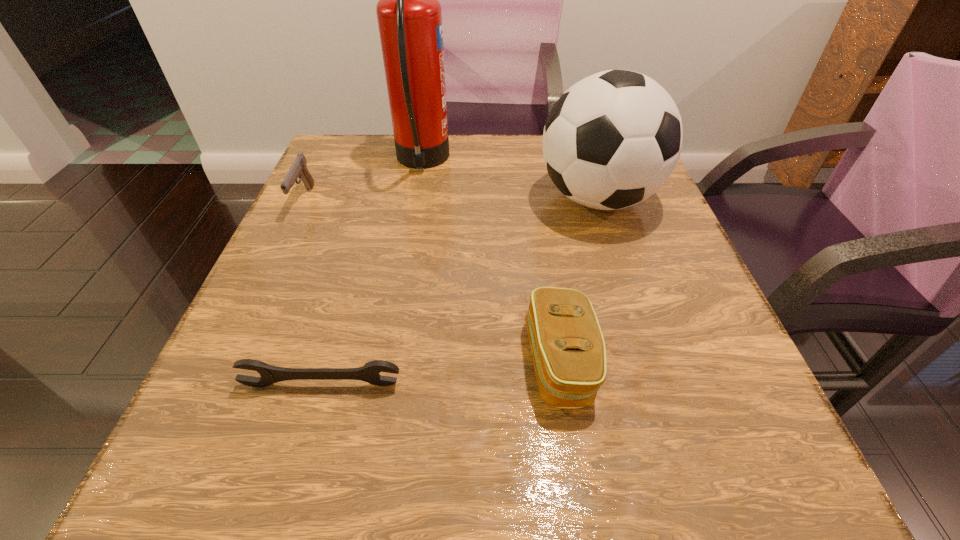
Locate an element on the screen. The image size is (960, 540). vacant area that lies between the shortest object and the soccer ball is located at coordinates (460, 292).

Find the location of a particular element. The height and width of the screenshot is (540, 960). vacant area that lies between the tallest object and the leftmost object is located at coordinates pyautogui.click(x=363, y=181).

You are a GUI agent. You are given a task and a screenshot of the screen. Output one action in this format:
    pyautogui.click(x=<x>, y=<y>)
    Task: Click on the vacant space in between the pistol and the soccer ball
    The width and height of the screenshot is (960, 540).
    Given the screenshot: What is the action you would take?
    [x=451, y=199]

Locate an element on the screen. Image resolution: width=960 pixels, height=540 pixels. vacant area between the pistol and the wrench is located at coordinates (313, 292).

Identify the location of vacant space that's between the wrench and the fourth shortest object. This screenshot has height=540, width=960. (460, 292).

You are a GUI agent. You are given a task and a screenshot of the screen. Output one action in this format:
    pyautogui.click(x=<x>, y=<y>)
    Task: Click on the object that is the second nearest to the tallest object
    The image size is (960, 540).
    Given the screenshot: What is the action you would take?
    pyautogui.click(x=612, y=139)

Find the location of a particular element. The height and width of the screenshot is (540, 960). the third closest object to the clutch bag is located at coordinates (409, 15).

This screenshot has width=960, height=540. I want to click on vacant space that satisfies the following two spatial constraints: 1. on the surface of the soccer ball; 2. on the right side of the tallest object, so click(416, 198).

Find the location of `free point that satisfies the following two spatial constraints: 1. on the zipper side of the clutch bag; 2. on the open ends of the wrench`. free point that satisfies the following two spatial constraints: 1. on the zipper side of the clutch bag; 2. on the open ends of the wrench is located at coordinates (564, 384).

This screenshot has width=960, height=540. In order to click on free space that satisfies the following two spatial constraints: 1. on the back side of the fourth shortest object; 2. on the surface of the tallest object in this screenshot , I will do [586, 161].